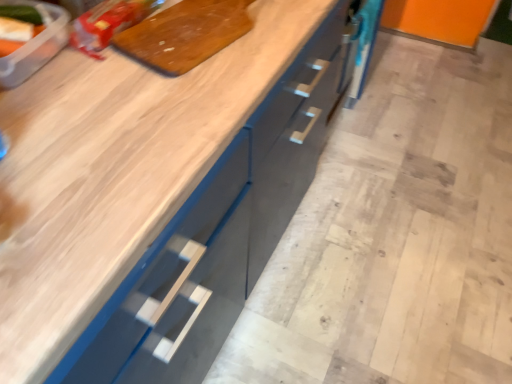
Identify the location of vacant space in front of translucent plastic container at upper left, placed as the second food when sorted from right to left. This screenshot has width=512, height=384. (33, 116).